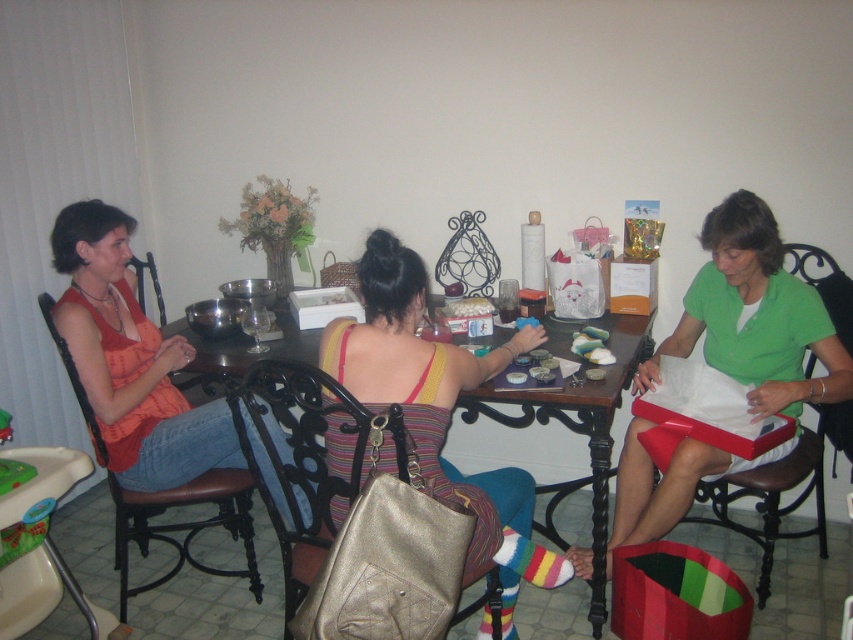
Question: Does wooden table at center have a greater width compared to brown leather chair at left?

Choices:
 (A) yes
 (B) no

Answer: (B)

Question: Considering the relative positions of striped fabric dress at center and wooden table at center in the image provided, where is striped fabric dress at center located with respect to wooden table at center?

Choices:
 (A) right
 (B) left

Answer: (B)

Question: Can you confirm if metallic gold handbag at center is positioned above black leather chair at right?

Choices:
 (A) no
 (B) yes

Answer: (A)

Question: Which object is farther from the camera taking this photo?

Choices:
 (A) wooden table at center
 (B) metallic gold handbag at center
 (C) striped fabric dress at center

Answer: (A)

Question: Which object is positioned farthest from the wooden table at center?

Choices:
 (A) brown leather chair at left
 (B) striped fabric dress at center
 (C) black leather chair at right

Answer: (A)

Question: Which point is closer to the camera?

Choices:
 (A) (228, 496)
 (B) (196, 365)
 (C) (821, 548)

Answer: (A)